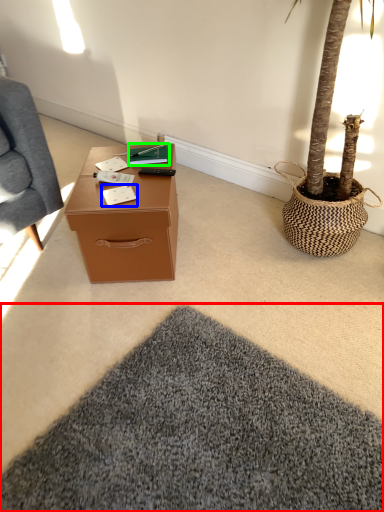
Question: Which object is positioned farthest from mat (highlighted by a red box)? Select from notepad (highlighted by a blue box) and book (highlighted by a green box).

Choices:
 (A) notepad
 (B) book

Answer: (B)